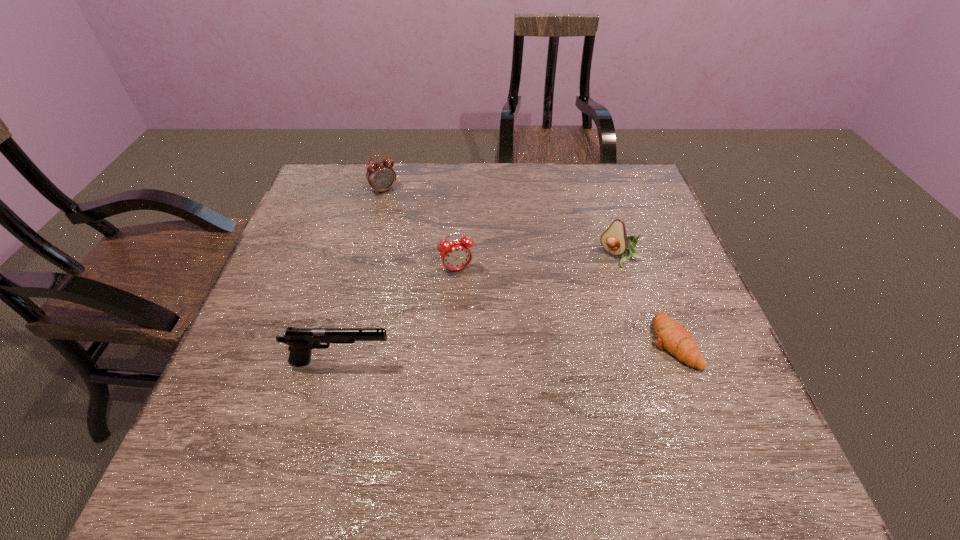
Find the location of a particular element. free space located on the face of the farthest object is located at coordinates (433, 258).

Where is `free space located on the face of the farthest object`? Image resolution: width=960 pixels, height=540 pixels. free space located on the face of the farthest object is located at coordinates (448, 279).

Locate an element on the screen. Image resolution: width=960 pixels, height=540 pixels. free region located on the seed side of the avocado is located at coordinates (533, 347).

Where is `free location located on the seed side of the avocado`? The image size is (960, 540). free location located on the seed side of the avocado is located at coordinates (595, 281).

Identify the location of blank space located 0.160m on the seed side of the avocado. (575, 302).

Find the location of a particular element. Image resolution: width=960 pixels, height=540 pixels. free point located 0.300m on the face of the nearer alarm clock is located at coordinates (500, 378).

The width and height of the screenshot is (960, 540). In order to click on vacant position located 0.390m on the face of the nearer alarm clock in this screenshot , I will do point(516,418).

I want to click on vacant space located on the face of the nearer alarm clock, so click(x=489, y=347).

At what (x,y) coordinates should I click in order to perform the action: click on object that is at the far edge. Please return your answer as a coordinate pair (x, y). Looking at the image, I should click on (381, 176).

I want to click on object situated at the left edge, so click(301, 341).